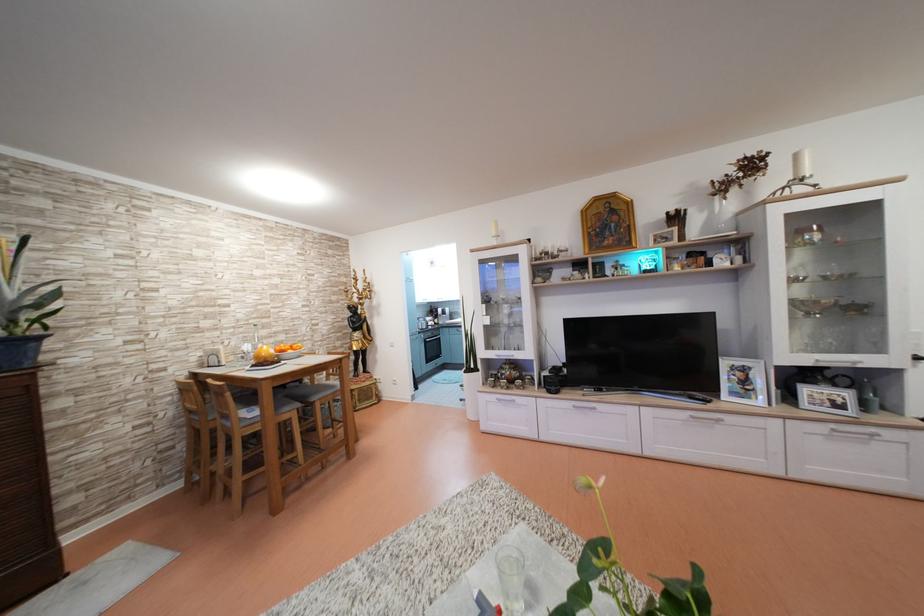
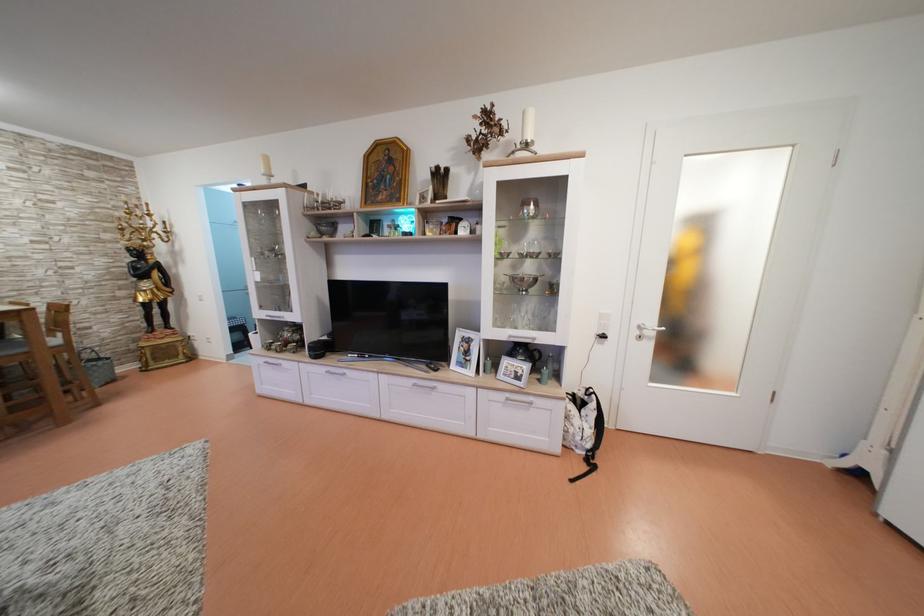
The point at (840, 431) is marked in the first image. Where is the corresponding point in the second image?

(515, 400)